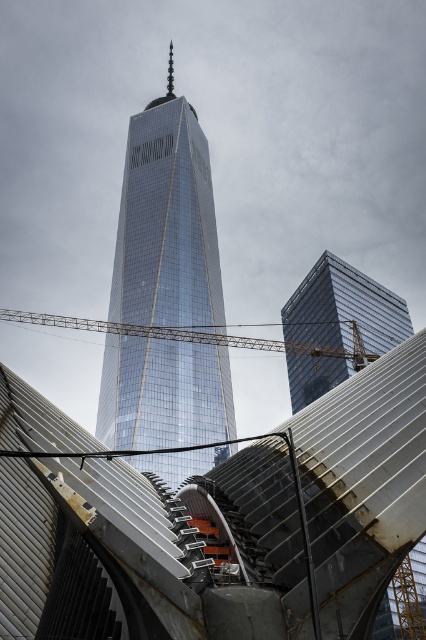
Which is above, glossy glass tower at center or metallic yellow crane at center?

Positioned higher is glossy glass tower at center.

Does glossy glass tower at center have a smaller size compared to metallic yellow crane at center?

No, glossy glass tower at center is not smaller than metallic yellow crane at center.

Find the location of a particular element. glossy glass tower at center is located at coordinates (166, 221).

Does point (115, 289) come behind point (321, 388)?

Yes, it is.

In the scene shown: Can you confirm if glossy glass tower at center is smaller than glossy glass building at center?

Actually, glossy glass tower at center might be larger than glossy glass building at center.

Is point (203, 176) behind point (348, 337)?

Yes, point (203, 176) is farther from viewer.

At what (x,y) coordinates should I click in order to perform the action: click on glossy glass tower at center. Please return your answer as a coordinate pair (x, y). The image size is (426, 640). Looking at the image, I should click on (166, 221).

Is glossy glass building at center to the left of metallic yellow crane at center from the viewer's perspective?

No, glossy glass building at center is not to the left of metallic yellow crane at center.

Is glossy glass building at center positioned at the back of metallic yellow crane at center?

Yes, glossy glass building at center is further from the viewer.

You are a GUI agent. You are given a task and a screenshot of the screen. Output one action in this format:
    pyautogui.click(x=<x>, y=<y>)
    Task: Click on the glossy glass building at center
    
    Given the screenshot: What is the action you would take?
    pyautogui.click(x=344, y=308)

This screenshot has height=640, width=426. Find the location of `glossy glass building at center`. glossy glass building at center is located at coordinates (344, 308).